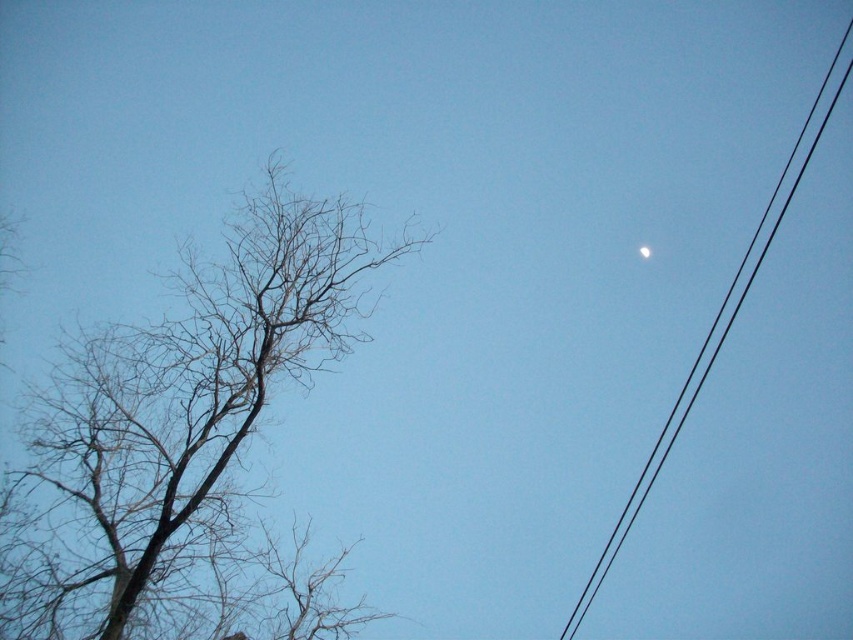
You are standing at the point labeled point (793,156). You want to walk directly towards the moon in the upper right quadrant. How far will you have to walk to reach the moon?

The distance between you and the moon is 15.80 meters, so you will have to walk 15.80 meters to reach it.

You are an astronomer observing the sky and notice the black wire at upper right and the white glossy moon at upper right. Which object is positioned higher in the sky?

The black wire at upper right is above the white glossy moon at upper right, so it is positioned higher in the sky.